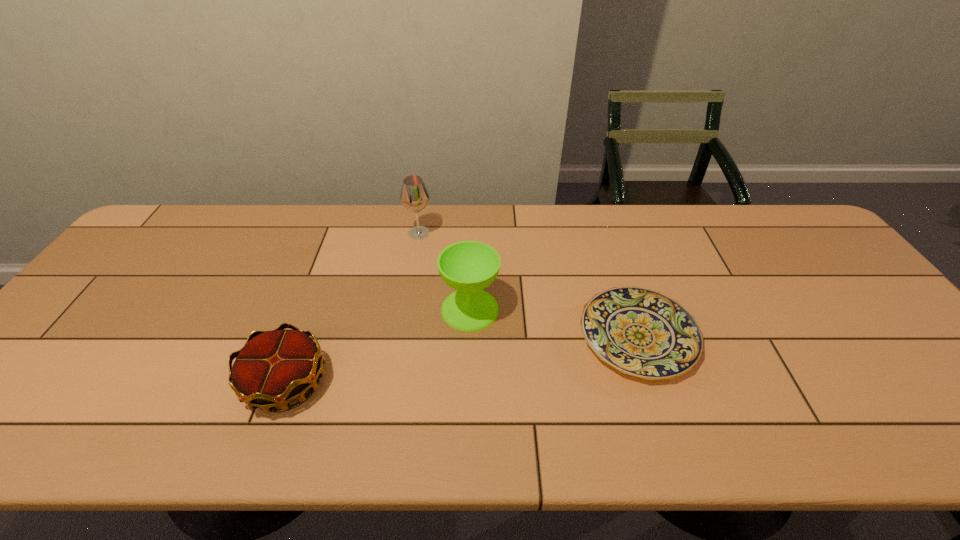
You are a GUI agent. You are given a task and a screenshot of the screen. Output one action in this format:
    pyautogui.click(x=<x>, y=<y>)
    Task: Click on the free region located 0.050m on the back of the leftmost object
    Image resolution: width=960 pixels, height=540 pixels.
    Given the screenshot: What is the action you would take?
    pyautogui.click(x=304, y=332)

Identify the location of free spot located 0.180m on the back of the shortest object. This screenshot has height=540, width=960. (611, 251).

What are the coordinates of `object that is at the far edge` in the screenshot? It's located at (414, 196).

Find the location of `object that is at the near edge`. object that is at the near edge is located at coordinates (274, 368).

Locate an element on the screen. This screenshot has height=540, width=960. free space at the far edge of the desktop is located at coordinates (247, 226).

Locate an element on the screen. Image resolution: width=960 pixels, height=540 pixels. vacant area at the near edge is located at coordinates (310, 441).

You are a GUI agent. You are given a task and a screenshot of the screen. Output one action in this format:
    pyautogui.click(x=<x>, y=<y>)
    Task: Click on the vacant area at the left edge
    The image size is (960, 540).
    Given the screenshot: What is the action you would take?
    pyautogui.click(x=39, y=407)

Locate an element on the screen. The height and width of the screenshot is (540, 960). blank space at the right edge of the desktop is located at coordinates (895, 406).

Image resolution: width=960 pixels, height=540 pixels. What are the coordinates of `vacant space at the far left corner` in the screenshot? It's located at (174, 206).

Find the location of a particular element. The image size is (960, 540). vacant area at the far right corner is located at coordinates (773, 207).